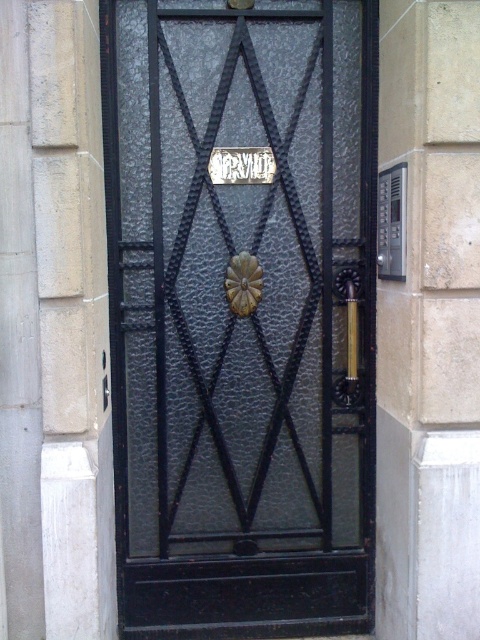
This screenshot has width=480, height=640. I want to click on black textured metal door at center, so click(x=239, y=316).

Is point (205, 60) farther from camera compared to point (351, 380)?

No, (205, 60) is in front of (351, 380).

Identify the location of black textured metal door at center. (239, 316).

Is black textured metal door at center positioned behind gold textured door handle at center?

No, black textured metal door at center is in front of gold textured door handle at center.

Is point (230, 356) positioned before point (254, 285)?

No, it is behind (254, 285).

Which is behind, point (275, 458) or point (245, 276)?

Point (275, 458)

In order to click on black textured metal door at center in this screenshot , I will do point(239,316).

Which of these two, gold metallic door handle at right or gold textured door handle at center, stands shorter?

With less height is gold textured door handle at center.

From the picture: Measure the distance between point [339,288] and camera.

Point [339,288] is 11.36 feet from camera.

The width and height of the screenshot is (480, 640). I want to click on gold metallic door handle at right, so click(x=348, y=333).